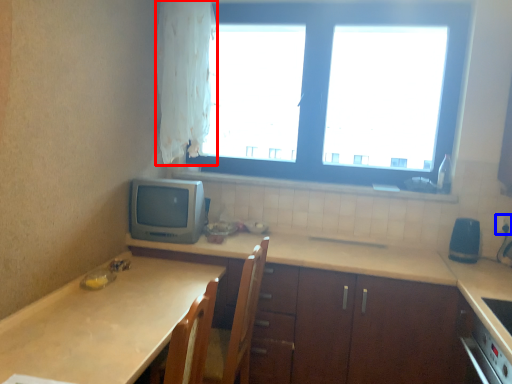
Question: Which of the following is the farthest to the observer, curtain (highlighted by a red box) or electric outlet (highlighted by a blue box)?

Choices:
 (A) curtain
 (B) electric outlet

Answer: (B)